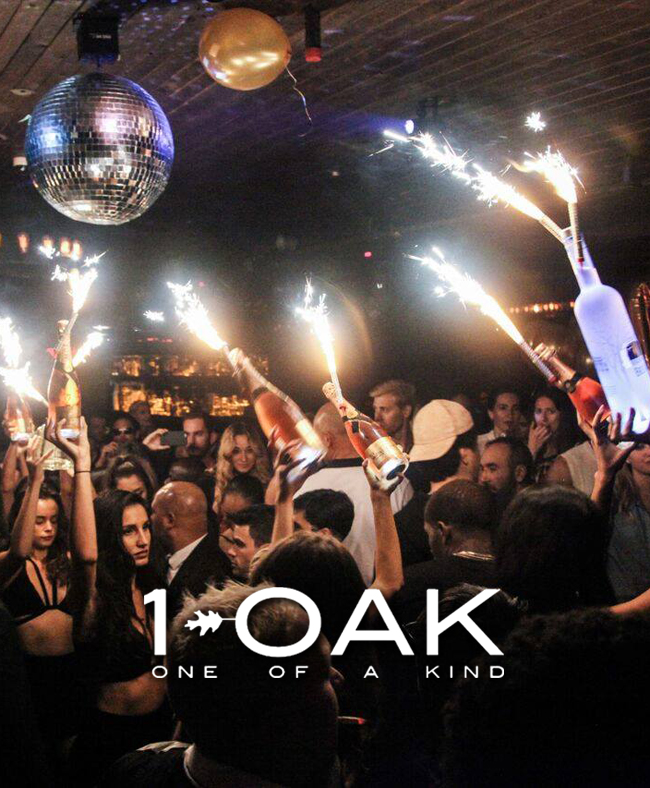
The height and width of the screenshot is (788, 650). In order to click on wooden ceiling in this screenshot , I will do `click(429, 54)`.